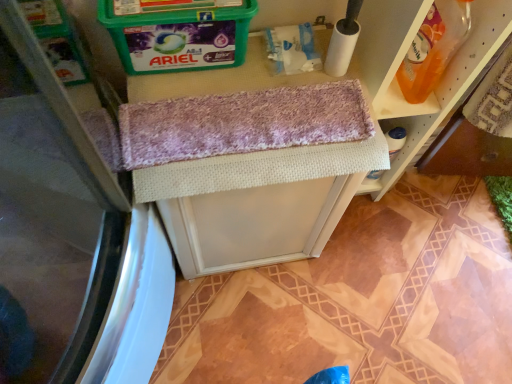
Question: From a real-world perspective, does translucent orange bottle at upper right sit lower than woven fabric vanity at center?

Choices:
 (A) yes
 (B) no

Answer: (B)

Question: Is translucent orange bottle at upper right closer to the viewer compared to woven fabric vanity at center?

Choices:
 (A) yes
 (B) no

Answer: (A)

Question: Is translucent orange bottle at upper right far away from woven fabric vanity at center?

Choices:
 (A) yes
 (B) no

Answer: (B)

Question: Is translucent orange bottle at upper right thinner than woven fabric vanity at center?

Choices:
 (A) no
 (B) yes

Answer: (B)

Question: Does translucent orange bottle at upper right have a larger size compared to woven fabric vanity at center?

Choices:
 (A) yes
 (B) no

Answer: (B)

Question: Is translucent orange bottle at upper right positioned beyond the bounds of woven fabric vanity at center?

Choices:
 (A) no
 (B) yes

Answer: (B)

Question: Considering the relative sizes of woven fabric vanity at center and translucent orange bottle at upper right in the image provided, is woven fabric vanity at center bigger than translucent orange bottle at upper right?

Choices:
 (A) yes
 (B) no

Answer: (A)

Question: Is woven fabric vanity at center at the right side of translucent orange bottle at upper right?

Choices:
 (A) yes
 (B) no

Answer: (B)

Question: Can you confirm if woven fabric vanity at center is wider than translucent orange bottle at upper right?

Choices:
 (A) yes
 (B) no

Answer: (A)

Question: Could you tell me if woven fabric vanity at center is turned towards translucent orange bottle at upper right?

Choices:
 (A) no
 (B) yes

Answer: (A)

Question: Is woven fabric vanity at center not within translucent orange bottle at upper right?

Choices:
 (A) yes
 (B) no

Answer: (A)

Question: From the image's perspective, is woven fabric vanity at center under translucent orange bottle at upper right?

Choices:
 (A) yes
 (B) no

Answer: (A)

Question: From the image's perspective, relative to translucent orange bottle at upper right, is woven fabric vanity at center above or below?

Choices:
 (A) below
 (B) above

Answer: (A)